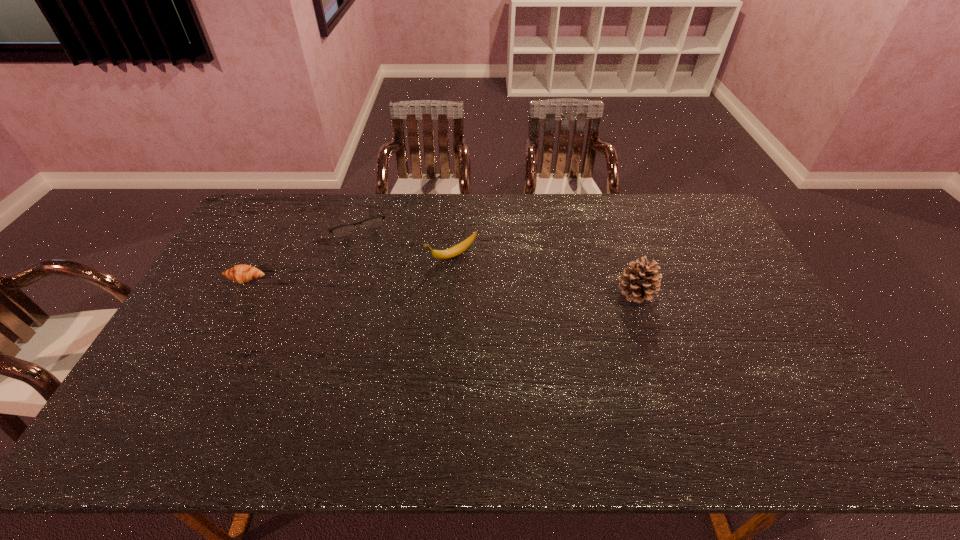
In the image, there is a desktop. Where is `free space at the right edge`? free space at the right edge is located at coordinates (718, 256).

Identify the location of vacant area at the far right corner. (670, 213).

Where is `free region at the near right corner of the desktop`? free region at the near right corner of the desktop is located at coordinates (761, 377).

Find the location of a particular element. unoccupied area between the pinecone and the spectacles is located at coordinates (495, 255).

Where is `free point between the tallest object and the second object from left to right`? The height and width of the screenshot is (540, 960). free point between the tallest object and the second object from left to right is located at coordinates (495, 255).

At what (x,y) coordinates should I click in order to perform the action: click on vacant point located between the spectacles and the second object from right to left. Please return your answer as a coordinate pair (x, y). Image resolution: width=960 pixels, height=540 pixels. Looking at the image, I should click on (403, 238).

Where is `vacant area between the spectacles and the rightmost object`? vacant area between the spectacles and the rightmost object is located at coordinates (495, 255).

Identify the location of vacant region between the tallest object and the second tallest object. This screenshot has width=960, height=540. (544, 274).

The height and width of the screenshot is (540, 960). I want to click on empty location between the second farthest object and the tallest object, so click(x=544, y=274).

Locate an element on the screen. The height and width of the screenshot is (540, 960). free space between the banana and the rightmost object is located at coordinates (544, 274).